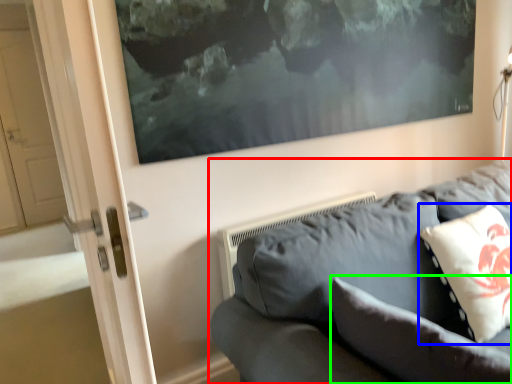
Question: Based on their relative distances, which object is farther from studio couch (highlighted by a red box)? Choose from pillow (highlighted by a blue box) and pillow (highlighted by a green box).

Choices:
 (A) pillow
 (B) pillow

Answer: (A)